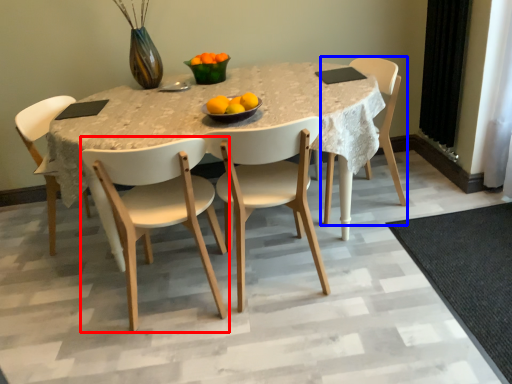
Question: Which of the following is the closest to the observer, chair (highlighted by a red box) or chair (highlighted by a blue box)?

Choices:
 (A) chair
 (B) chair

Answer: (A)